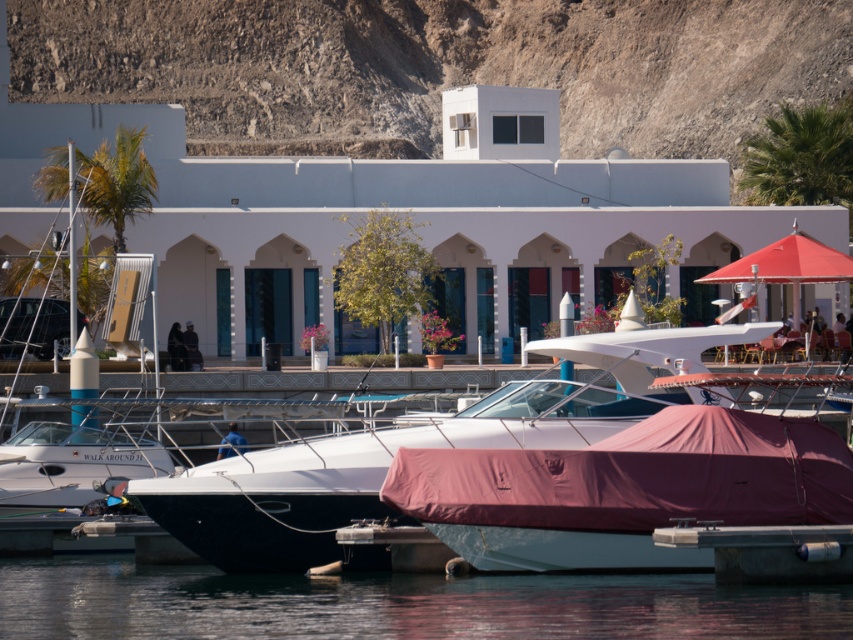
Question: Where is dull gray rock at upper center located in relation to transparent water at lower center in the image?

Choices:
 (A) left
 (B) right

Answer: (B)

Question: Which of the following is the farthest from the observer?

Choices:
 (A) (4, 576)
 (B) (412, 0)

Answer: (B)

Question: Which point is closer to the camera?

Choices:
 (A) (659, 397)
 (B) (364, 67)
 (C) (753, 612)
 (D) (0, 497)

Answer: (C)

Question: Observing the image, what is the correct spatial positioning of transparent water at lower center in reference to white glossy boat at left?

Choices:
 (A) above
 (B) below

Answer: (B)

Question: Which of the following is the farthest from the observer?

Choices:
 (A) transparent water at lower center
 (B) white matte boat at center
 (C) white glossy boat at left
 (D) dull gray rock at upper center

Answer: (D)

Question: Does dull gray rock at upper center appear on the left side of white glossy boat at left?

Choices:
 (A) no
 (B) yes

Answer: (A)